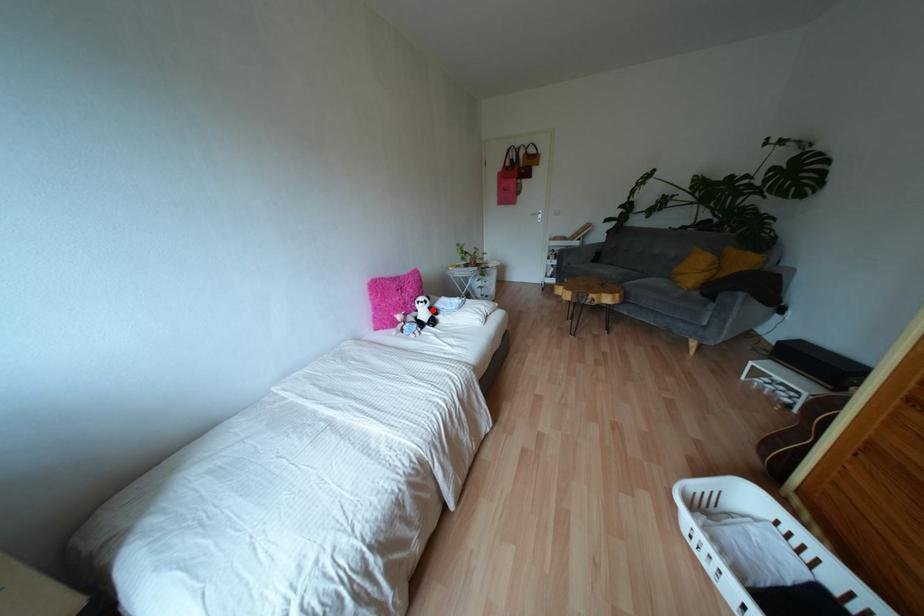
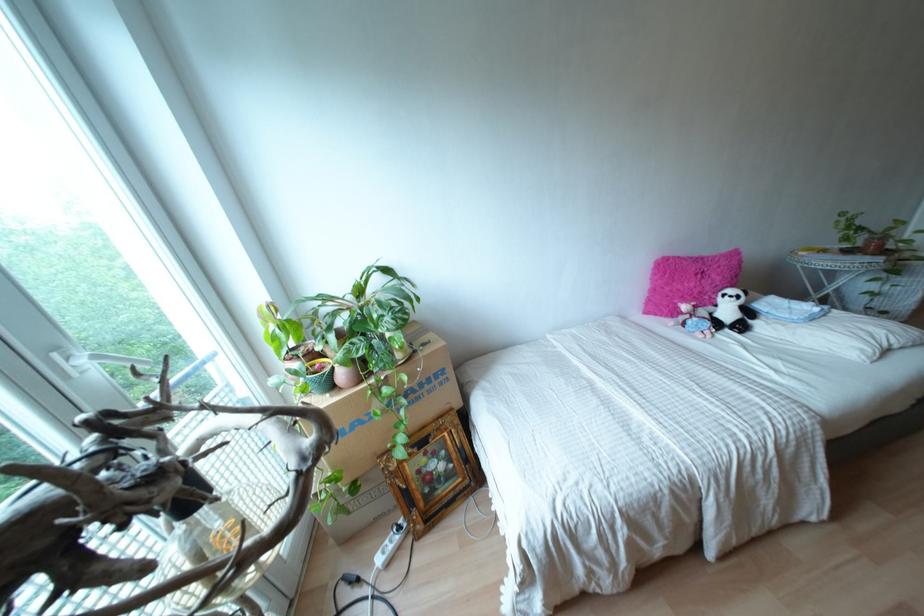
In the second image, find the point that corresponds to the highlighted location in the first image.

(747, 312)